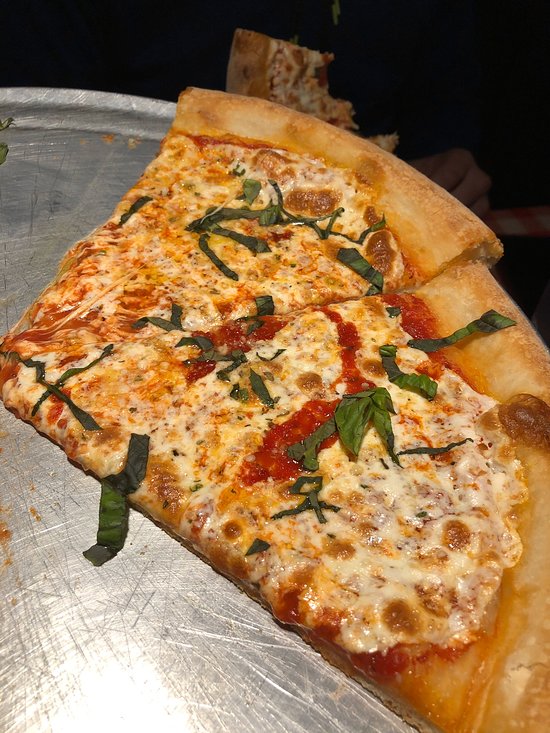
Locate an element on the screen. The height and width of the screenshot is (733, 550). tray is located at coordinates (226, 688).